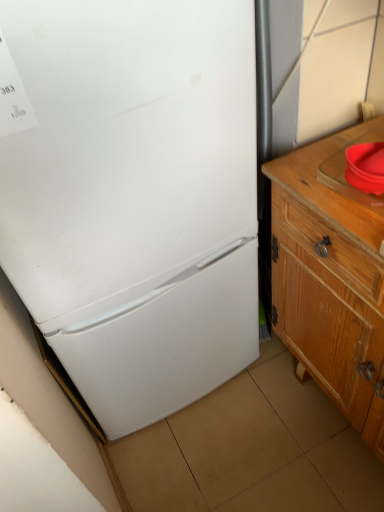
Question: From a real-world perspective, is wooden cabinet at right positioned above or below white matte refrigerator at left?

Choices:
 (A) above
 (B) below

Answer: (B)

Question: From the image's perspective, relative to white matte refrigerator at left, is wooden cabinet at right above or below?

Choices:
 (A) below
 (B) above

Answer: (A)

Question: Which object is the closest to the wooden cabinet at right?

Choices:
 (A) red plastic sink at right
 (B) white matte refrigerator at left

Answer: (A)

Question: Which object is positioned farthest from the wooden cabinet at right?

Choices:
 (A) red plastic sink at right
 (B) white matte refrigerator at left

Answer: (B)